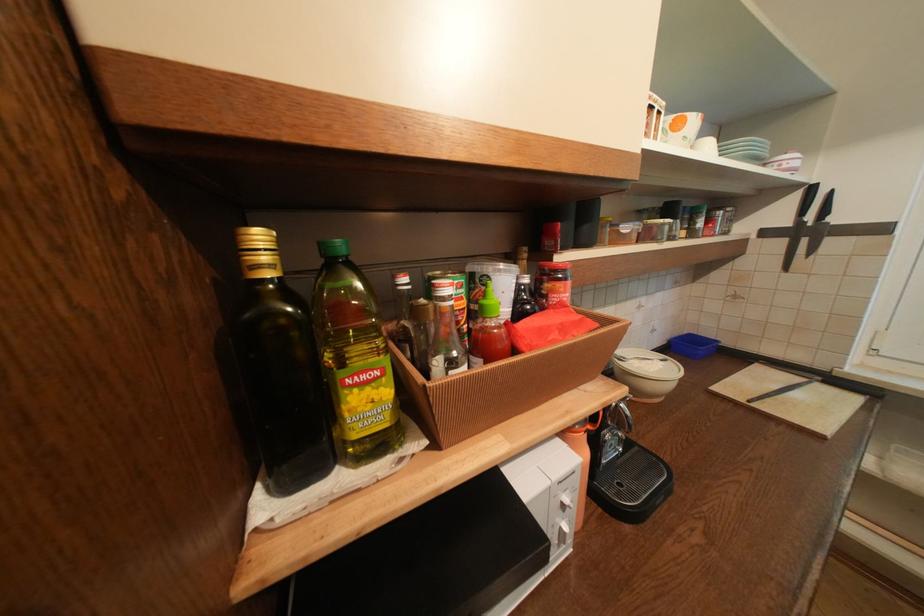
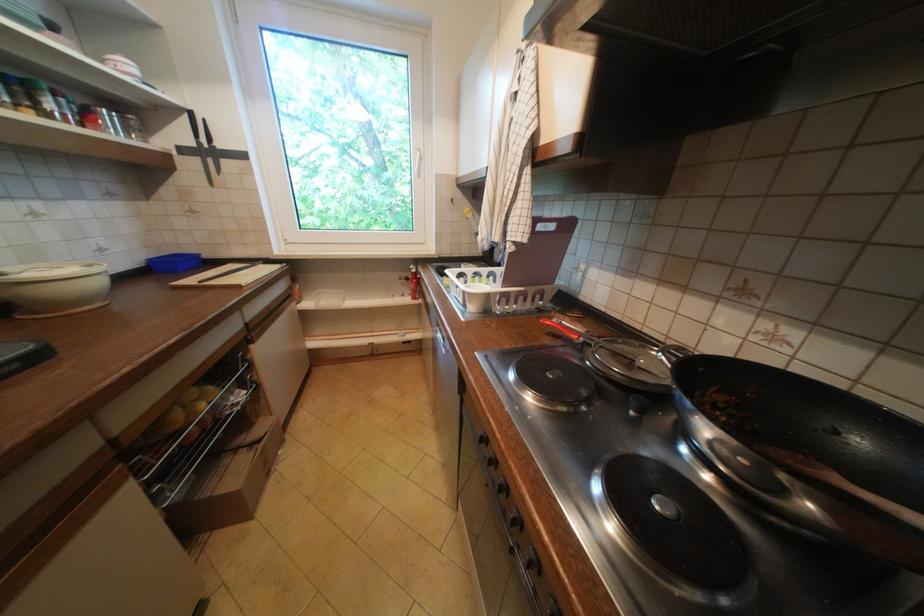
Find the pixel in the second image that matches the point at 807,196 in the first image.

(195, 119)